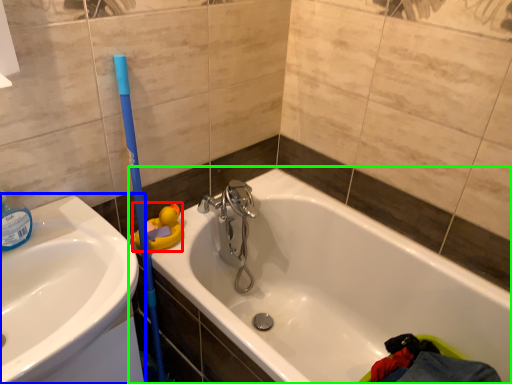
Question: Which object is the closest to the toy (highlighted by a red box)? Choose among these: sink (highlighted by a blue box) or bathtub (highlighted by a green box).

Choices:
 (A) sink
 (B) bathtub

Answer: (A)